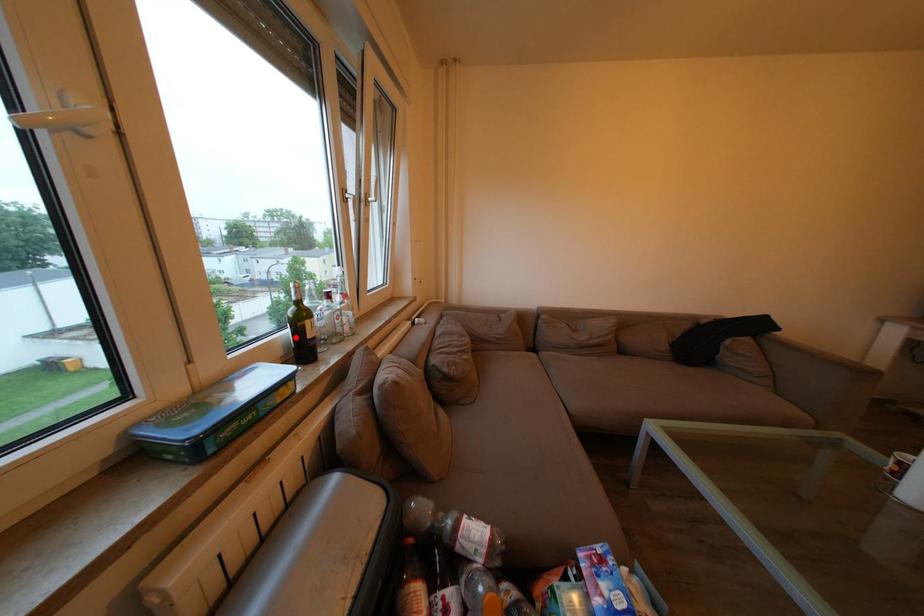
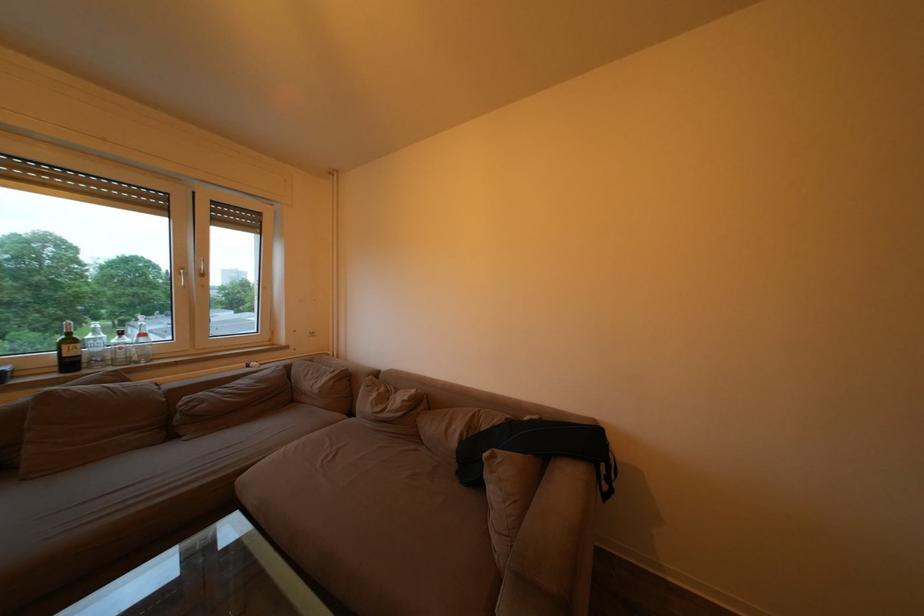
In the second image, find the point that corresponds to the highlighted location in the first image.

(76, 358)